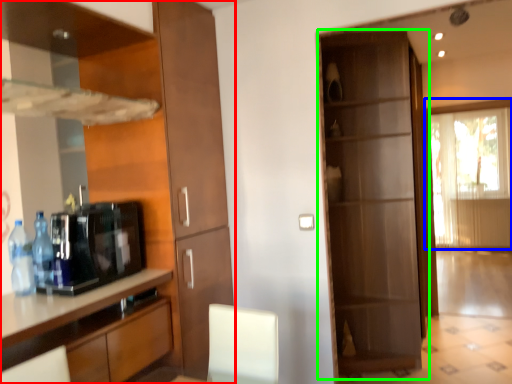
Question: Which object is the closest to the cabinetry (highlighted by a red box)? Choose among these: window (highlighted by a blue box) or door (highlighted by a green box).

Choices:
 (A) window
 (B) door

Answer: (B)